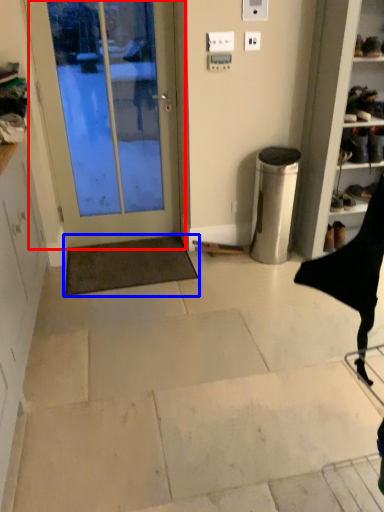
Question: Which object is further to the camera taking this photo, door (highlighted by a red box) or doormat (highlighted by a blue box)?

Choices:
 (A) door
 (B) doormat

Answer: (B)